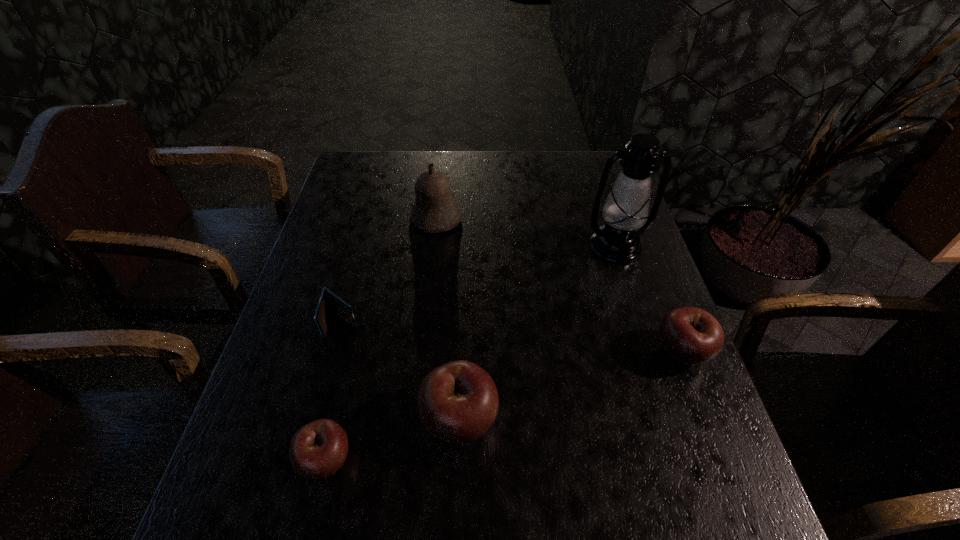
This screenshot has height=540, width=960. Find the location of `the leftmost apple`. the leftmost apple is located at coordinates (317, 450).

Where is `the tallest apple`? the tallest apple is located at coordinates pyautogui.click(x=458, y=402).

Where is `the fourth shortest object`? The image size is (960, 540). the fourth shortest object is located at coordinates (458, 402).

I want to click on the rightmost apple, so click(691, 336).

You are a GUI agent. You are given a task and a screenshot of the screen. Output one action in this format:
    pyautogui.click(x=<x>, y=<y>)
    Task: Click on the fourth tallest object
    The height and width of the screenshot is (540, 960).
    Given the screenshot: What is the action you would take?
    pyautogui.click(x=691, y=336)

This screenshot has height=540, width=960. What are the coordinates of `wallet` in the screenshot? It's located at (328, 302).

Where is `the fifth shortest object`? the fifth shortest object is located at coordinates (434, 210).

Identify the location of the tallest object. This screenshot has width=960, height=540. (626, 208).

In order to click on free space located on the side of the shortest apple with the unique marking in this screenshot , I will do `click(467, 460)`.

The image size is (960, 540). Identify the location of vacant position located on the side of the second apple from left to right with the unique marking. (679, 419).